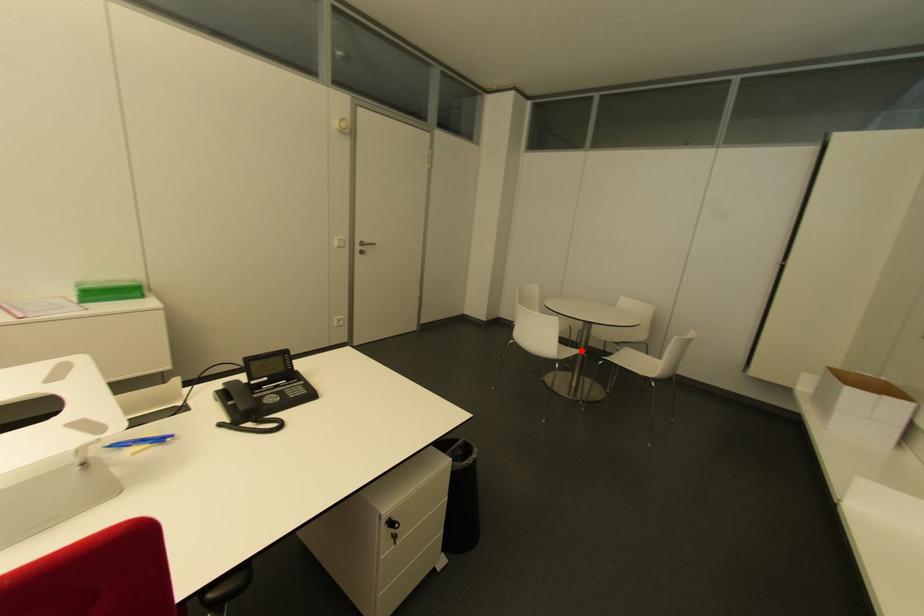
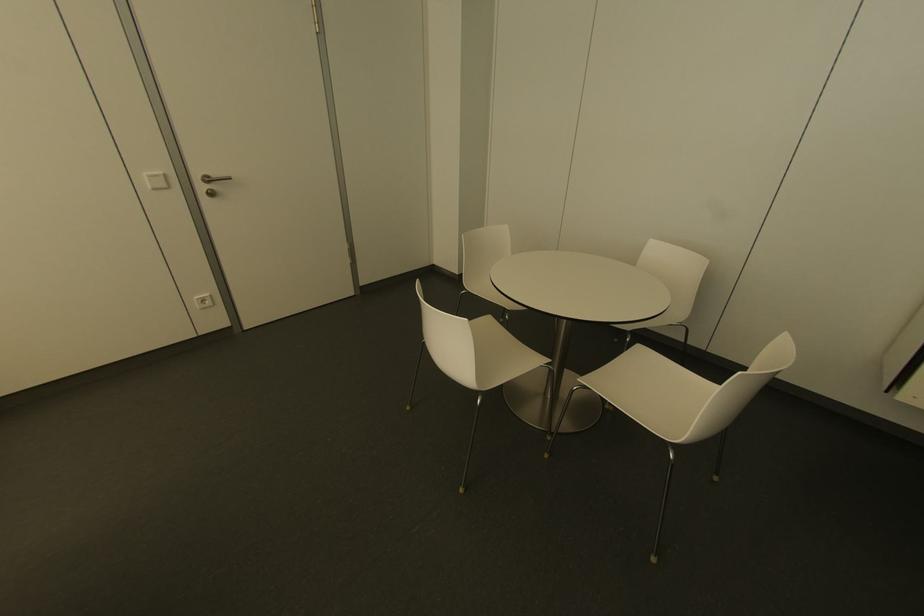
Question: I am providing you with two images of the same scene from different viewpoints. A red point is shown in image1. For the corresponding object point in image2, is it positioned nearer or farther from the camera?

Choices:
 (A) Nearer
 (B) Farther

Answer: (A)